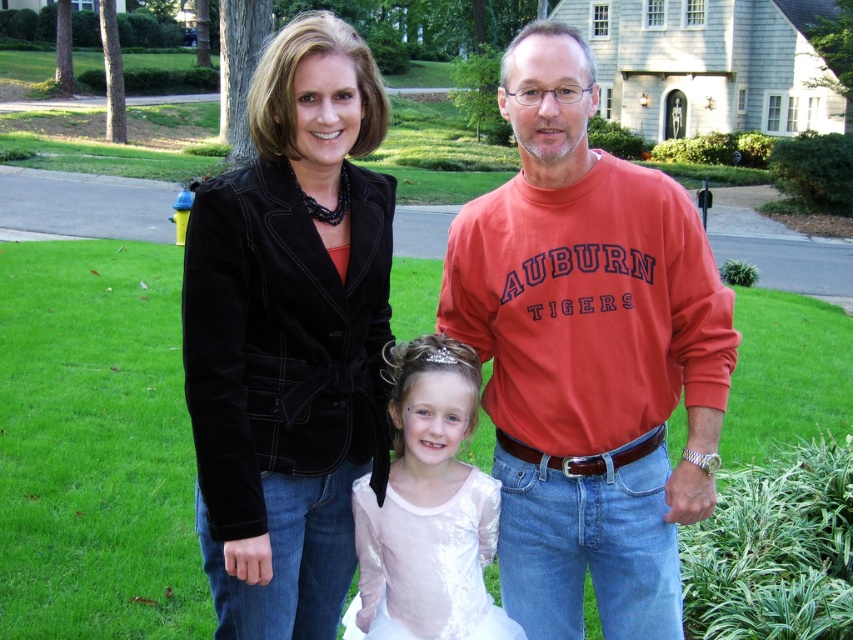
Question: Can you confirm if black velvet jacket at center is thinner than white satin dress at center?

Choices:
 (A) yes
 (B) no

Answer: (A)

Question: Is black velvet jacket at center thinner than white satin dress at center?

Choices:
 (A) yes
 (B) no

Answer: (A)

Question: Is orange cotton sweatshirt at center smaller than white satin dress at center?

Choices:
 (A) no
 (B) yes

Answer: (A)

Question: Which of the following is the farthest from the observer?

Choices:
 (A) pos(276,246)
 (B) pos(489,620)
 (C) pos(517,100)

Answer: (B)

Question: Which point is farther to the camera?

Choices:
 (A) pos(427,445)
 (B) pos(570,573)

Answer: (B)

Question: Which object appears closest to the camera in this image?

Choices:
 (A) orange cotton sweatshirt at center
 (B) white satin dress at center
 (C) black velvet jacket at center

Answer: (C)